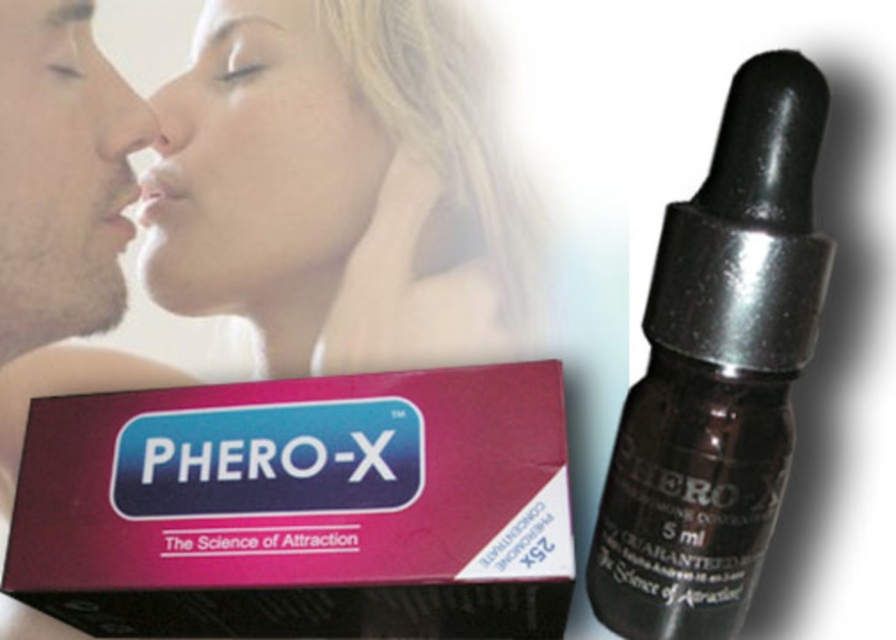
Does matte pink skin at center have a smaller size compared to matte pink lipstick at center?

Actually, matte pink skin at center might be larger than matte pink lipstick at center.

Between matte pink skin at center and matte pink lipstick at center, which one is positioned higher?

matte pink skin at center is higher up.

Identify the location of matte pink skin at center. Image resolution: width=896 pixels, height=640 pixels. (336, 192).

Between matte pink box at upper left and matte skin nose at center, which one is positioned lower?

Positioned lower is matte pink box at upper left.

Can you confirm if matte pink box at upper left is smaller than matte skin nose at center?

Actually, matte pink box at upper left might be larger than matte skin nose at center.

Does point (444, 636) lie behind point (181, 141)?

No, it is not.

Where is `matte pink box at upper left`? Image resolution: width=896 pixels, height=640 pixels. matte pink box at upper left is located at coordinates click(x=300, y=508).

The image size is (896, 640). Identify the location of transparent glass dropper at center. (717, 371).

Which is below, transparent glass dropper at center or matte black face at left?

Positioned lower is transparent glass dropper at center.

Which is behind, point (704, 252) or point (112, 266)?

The point (112, 266) is more distant.

What are the coordinates of `transparent glass dropper at center` in the screenshot? It's located at (717, 371).